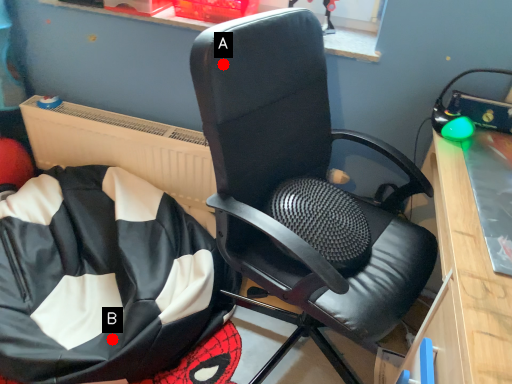
Question: Two points are circled on the image, labeled by A and B beside each circle. Which of the following is the farthest from the observer?

Choices:
 (A) A is further
 (B) B is further

Answer: (B)